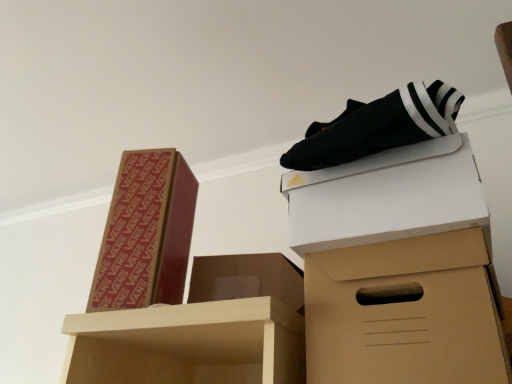
Question: Is brown cardboard box at lower right to the left of white cardboard box at upper right, the first box positioned from the right, from the viewer's perspective?

Choices:
 (A) yes
 (B) no

Answer: (B)

Question: Is brown cardboard box at lower right not inside white cardboard box at upper right, which ranks as the third box in left-to-right order?

Choices:
 (A) yes
 (B) no

Answer: (A)

Question: Considering the relative sizes of brown cardboard box at lower right and white cardboard box at upper right, the first box positioned from the right, in the image provided, is brown cardboard box at lower right wider than white cardboard box at upper right, the first box positioned from the right,?

Choices:
 (A) yes
 (B) no

Answer: (B)

Question: Does brown cardboard box at lower right appear on the right side of white cardboard box at upper right, the first box positioned from the right?

Choices:
 (A) no
 (B) yes

Answer: (B)

Question: Is brown cardboard box at lower right facing away from white cardboard box at upper right, which ranks as the third box in left-to-right order?

Choices:
 (A) no
 (B) yes

Answer: (A)

Question: Visually, is brown cardboard box at center, marked as the 2th box in a left-to-right arrangement, positioned to the left or to the right of brown cardboard box at lower right?

Choices:
 (A) left
 (B) right

Answer: (A)

Question: Is brown cardboard box at center, the second box viewed from the right, taller or shorter than brown cardboard box at lower right?

Choices:
 (A) tall
 (B) short

Answer: (B)

Question: Is brown cardboard box at center, the second box viewed from the right, inside the boundaries of brown cardboard box at lower right, or outside?

Choices:
 (A) inside
 (B) outside

Answer: (B)

Question: Looking at their shapes, would you say brown cardboard box at center, the second box viewed from the right, is wider or thinner than brown cardboard box at lower right?

Choices:
 (A) wide
 (B) thin

Answer: (B)

Question: Is point (425, 218) positioned closer to the camera than point (242, 264)?

Choices:
 (A) farther
 (B) closer

Answer: (B)

Question: Looking at their shapes, would you say brown cardboard box at lower right is wider or thinner than brown cardboard box at center, marked as the 2th box in a left-to-right arrangement?

Choices:
 (A) thin
 (B) wide

Answer: (B)

Question: From a real-world perspective, relative to brown cardboard box at center, the second box viewed from the right, is brown cardboard box at lower right vertically above or below?

Choices:
 (A) below
 (B) above

Answer: (A)

Question: From their relative heights in the image, would you say brown cardboard box at lower right is taller or shorter than brown cardboard box at center, the second box viewed from the right?

Choices:
 (A) short
 (B) tall

Answer: (B)

Question: Relative to brown cardboard box at lower right, is white cardboard box at upper right, the first box positioned from the right, in front or behind?

Choices:
 (A) behind
 (B) front

Answer: (A)

Question: In terms of height, does white cardboard box at upper right, which ranks as the third box in left-to-right order, look taller or shorter compared to brown cardboard box at lower right?

Choices:
 (A) short
 (B) tall

Answer: (A)